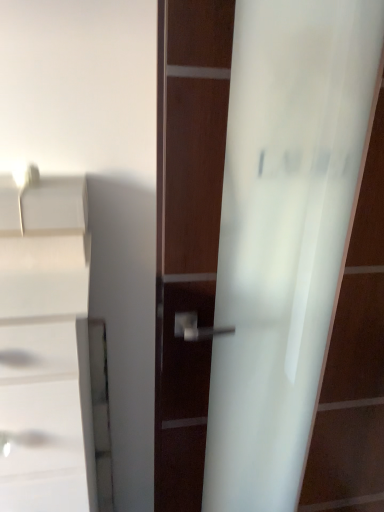
Question: Does frosted glass door handle at center touch white glossy cabinet at left?

Choices:
 (A) no
 (B) yes

Answer: (A)

Question: Is frosted glass door handle at center oriented away from white glossy cabinet at left?

Choices:
 (A) yes
 (B) no

Answer: (B)

Question: Is frosted glass door handle at center further to the viewer compared to white glossy cabinet at left?

Choices:
 (A) no
 (B) yes

Answer: (B)

Question: Is frosted glass door handle at center outside of white glossy cabinet at left?

Choices:
 (A) yes
 (B) no

Answer: (A)

Question: Is frosted glass door handle at center far away from white glossy cabinet at left?

Choices:
 (A) yes
 (B) no

Answer: (B)

Question: Is frosted glass door handle at center closer to camera compared to white glossy cabinet at left?

Choices:
 (A) yes
 (B) no

Answer: (B)

Question: Considering the relative sizes of white glossy cabinet at left and frosted glass door handle at center in the image provided, is white glossy cabinet at left taller than frosted glass door handle at center?

Choices:
 (A) no
 (B) yes

Answer: (A)

Question: Is white glossy cabinet at left positioned in front of frosted glass door handle at center?

Choices:
 (A) no
 (B) yes

Answer: (B)

Question: Can we say white glossy cabinet at left lies outside frosted glass door handle at center?

Choices:
 (A) yes
 (B) no

Answer: (A)

Question: Is white glossy cabinet at left to the right of frosted glass door handle at center from the viewer's perspective?

Choices:
 (A) no
 (B) yes

Answer: (A)

Question: Is white glossy cabinet at left wider than frosted glass door handle at center?

Choices:
 (A) yes
 (B) no

Answer: (A)

Question: From a real-world perspective, is white glossy cabinet at left located beneath frosted glass door handle at center?

Choices:
 (A) no
 (B) yes

Answer: (B)

Question: Is white glossy cabinet at left inside the boundaries of frosted glass door handle at center, or outside?

Choices:
 (A) outside
 (B) inside

Answer: (A)